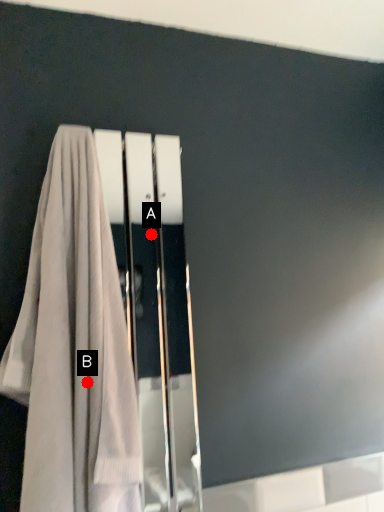
Question: Two points are circled on the image, labeled by A and B beside each circle. Which point appears farthest from the camera in this image?

Choices:
 (A) A is further
 (B) B is further

Answer: (A)